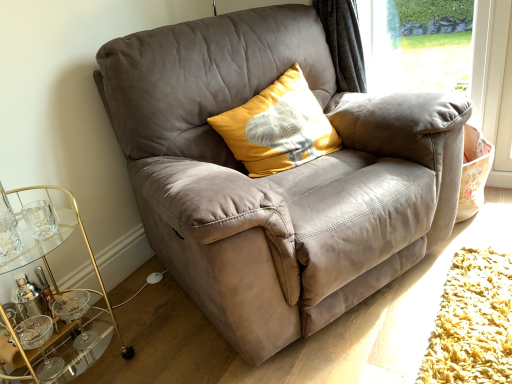
Question: Visually, is transparent glass window screen at upper right positioned to the left or to the right of suede gray chair at center?

Choices:
 (A) right
 (B) left

Answer: (A)

Question: From a real-world perspective, is transparent glass window screen at upper right above or below suede gray chair at center?

Choices:
 (A) below
 (B) above

Answer: (B)

Question: Based on their relative distances, which object is nearer to the transparent glass window screen at upper right?

Choices:
 (A) gold glass cocktail table at lower left
 (B) yellow textured cushion at center
 (C) suede gray chair at center

Answer: (B)

Question: Considering the real-world distances, which object is closest to the suede gray chair at center?

Choices:
 (A) gold glass cocktail table at lower left
 (B) transparent glass window screen at upper right
 (C) yellow textured cushion at center

Answer: (C)